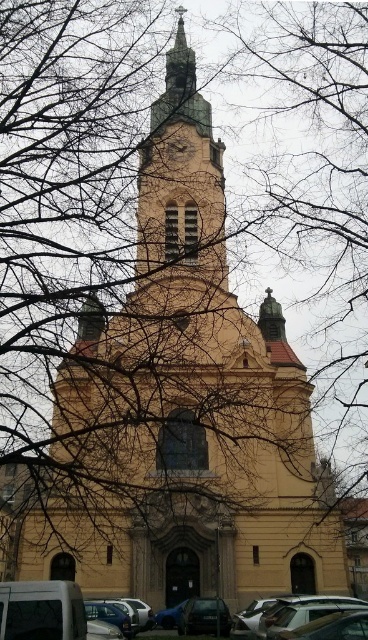
Question: Can you confirm if metallic silver car at lower right is positioned above gold metallic clock at upper center?

Choices:
 (A) yes
 (B) no

Answer: (B)

Question: Does metallic silver car at lower right have a lesser width compared to gold metallic clock at upper center?

Choices:
 (A) no
 (B) yes

Answer: (A)

Question: Does metallic silver car at lower right appear on the left side of gold metallic clock at upper center?

Choices:
 (A) no
 (B) yes

Answer: (A)